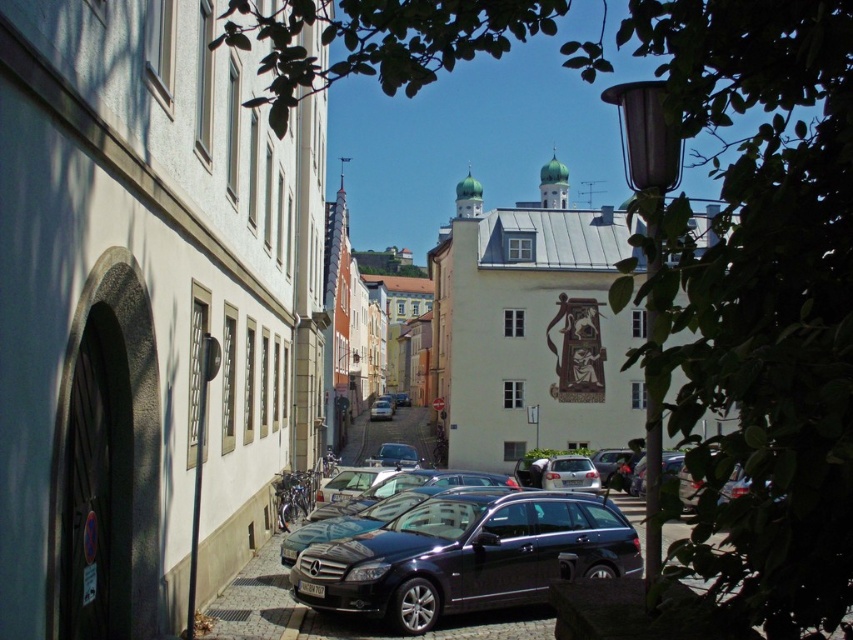
Question: Which point is farther to the camera?

Choices:
 (A) satin silver sedan at center
 (B) glossy black car at center
 (C) white matte car at center
 (D) shiny silver sedan at center

Answer: (A)

Question: Which of the following is the closest to the observer?

Choices:
 (A) click(x=416, y=461)
 (B) click(x=384, y=410)
 (C) click(x=585, y=488)
 (D) click(x=315, y=566)

Answer: (D)

Question: Does glossy black car at center have a smaller size compared to satin silver sedan at center?

Choices:
 (A) no
 (B) yes

Answer: (B)

Question: Among these points, which one is farthest from the camera?

Choices:
 (A) (374, 556)
 (B) (570, 467)
 (C) (386, 413)

Answer: (C)

Question: Is glossy black car at center below satin silver sedan at center?

Choices:
 (A) no
 (B) yes

Answer: (A)

Question: Does white matte car at center appear under shiny silver sedan at center?

Choices:
 (A) yes
 (B) no

Answer: (B)